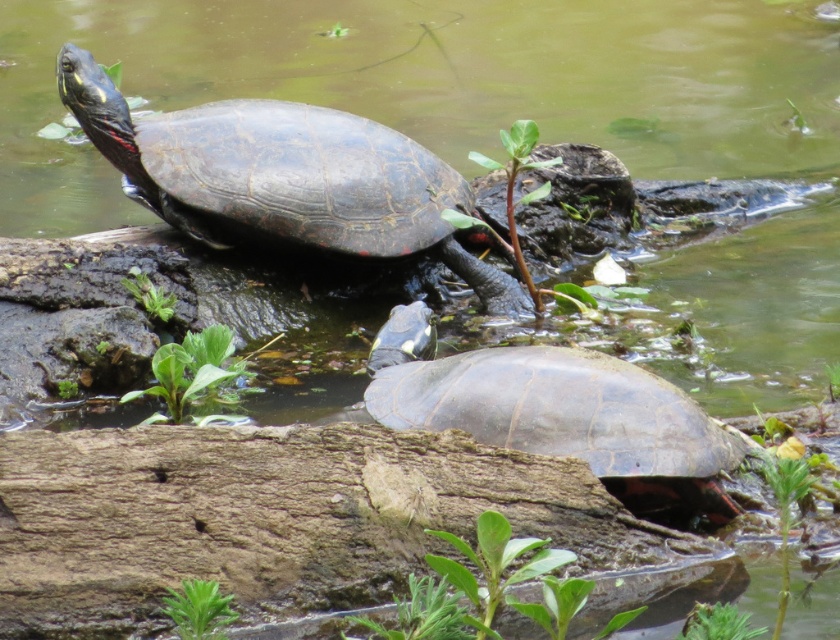
Can you confirm if shiny dark turtle at upper left is wider than shiny dark gray tortoise at center?

Indeed, shiny dark turtle at upper left has a greater width compared to shiny dark gray tortoise at center.

Find the location of a particular element. The image size is (840, 640). shiny dark turtle at upper left is located at coordinates (282, 177).

Identify the location of shiny dark turtle at upper left. The width and height of the screenshot is (840, 640). (282, 177).